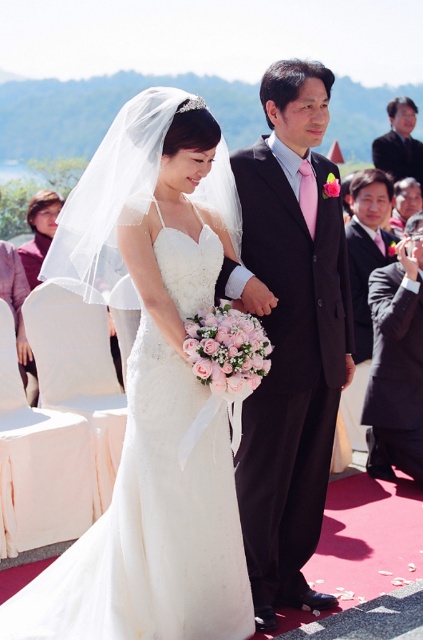
From the picture: Is white satin dress at center wider than black satin suit at right?

Yes, white satin dress at center is wider than black satin suit at right.

Which is behind, point (145, 394) or point (387, 186)?

Positioned behind is point (387, 186).

The height and width of the screenshot is (640, 423). I want to click on white satin dress at center, so click(x=153, y=524).

Does matte black suit at center appear on the right side of dark suit at upper right?

Incorrect, matte black suit at center is not on the right side of dark suit at upper right.

Who is shorter, matte black suit at center or dark suit at upper right?

dark suit at upper right

Who is more distant from viewer, (x=346, y=289) or (x=401, y=106)?

Point (x=401, y=106)

Locate an element on the screen. This screenshot has width=423, height=640. matte black suit at center is located at coordinates (290, 333).

Can you confirm if white satin dress at center is positioned to the left of dark suit at upper right?

Yes, white satin dress at center is to the left of dark suit at upper right.

Based on the photo, who is positioned more to the right, white satin dress at center or dark suit at upper right?

From the viewer's perspective, dark suit at upper right appears more on the right side.

Identify the location of white satin dress at center. This screenshot has width=423, height=640. (153, 524).